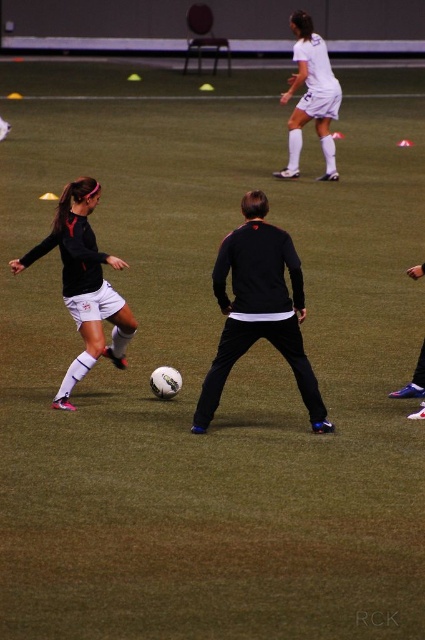
You are a soccer coach analyzing the training session. You notice the matte black soccer ball at center and the white matte soccer player at upper center. Which object has a greater width?

The matte black soccer ball at center has a greater width than the white matte soccer player at upper center.

You are a soccer coach analyzing the training session. You notice the black matte jacket at center and the matte black soccer ball at center. Which object is positioned to the right of the other?

The black matte jacket at center is positioned to the right of the matte black soccer ball at center.

You are standing at the point marked as point (81, 252) on the indoor soccer field. A soccer ball is rolling towards you from the direction of the female player in black and white. Can you safely stop the ball before it reaches you?

The point (81, 252) is 6.78 meters away from the viewer. Since the ball is coming from the female player in black and white, there is enough distance to safely stop the ball before it reaches you.